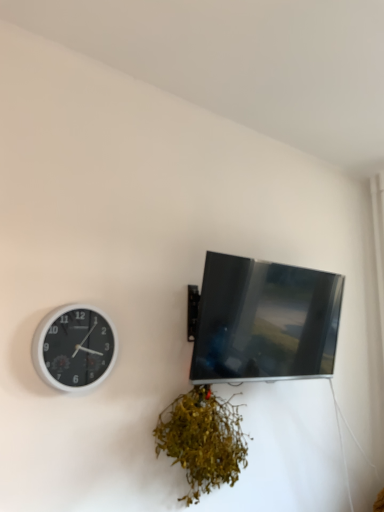
Question: Is white plastic wall clock at left situated inside green leafy plant at lower center or outside?

Choices:
 (A) inside
 (B) outside

Answer: (B)

Question: Is point (56, 381) closer or farther from the camera than point (168, 446)?

Choices:
 (A) closer
 (B) farther

Answer: (A)

Question: Which object is the farthest from the matte black tv at upper right?

Choices:
 (A) green leafy plant at lower center
 (B) white plastic wall clock at left

Answer: (B)

Question: Which object is positioned farthest from the green leafy plant at lower center?

Choices:
 (A) matte black tv at upper right
 (B) white plastic wall clock at left

Answer: (B)